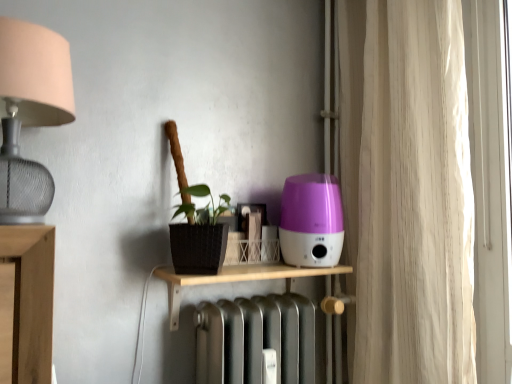
Question: Is beige fabric curtain at right inside purple glossy humidifier at center-right?

Choices:
 (A) no
 (B) yes

Answer: (A)

Question: Could you tell me if purple glossy humidifier at center-right is turned towards beige fabric curtain at right?

Choices:
 (A) no
 (B) yes

Answer: (A)

Question: Does purple glossy humidifier at center-right have a lesser height compared to beige fabric curtain at right?

Choices:
 (A) no
 (B) yes

Answer: (B)

Question: Is purple glossy humidifier at center-right further to camera compared to beige fabric curtain at right?

Choices:
 (A) no
 (B) yes

Answer: (B)

Question: From the image's perspective, is purple glossy humidifier at center-right below beige fabric curtain at right?

Choices:
 (A) yes
 (B) no

Answer: (A)

Question: From the image's perspective, relative to beige fabric curtain at right, is wooden shelf at center above or below?

Choices:
 (A) below
 (B) above

Answer: (A)

Question: From a real-world perspective, relative to beige fabric curtain at right, is wooden shelf at center vertically above or below?

Choices:
 (A) above
 (B) below

Answer: (B)

Question: Is point (335, 289) positioned closer to the camera than point (385, 135)?

Choices:
 (A) farther
 (B) closer

Answer: (A)

Question: Visually, is wooden shelf at center positioned to the left or to the right of beige fabric curtain at right?

Choices:
 (A) left
 (B) right

Answer: (A)

Question: Is matte silver lampshade at left situated inside purple glossy humidifier at center-right or outside?

Choices:
 (A) outside
 (B) inside

Answer: (A)

Question: Is point (0, 34) positioned closer to the camera than point (318, 177)?

Choices:
 (A) closer
 (B) farther

Answer: (A)

Question: From a real-world perspective, relative to purple glossy humidifier at center-right, is matte silver lampshade at left vertically above or below?

Choices:
 (A) below
 (B) above

Answer: (B)

Question: From the image's perspective, is matte silver lampshade at left above or below purple glossy humidifier at center-right?

Choices:
 (A) above
 (B) below

Answer: (A)

Question: Is wooden shelf at center inside the boundaries of matte silver lampshade at left, or outside?

Choices:
 (A) inside
 (B) outside

Answer: (B)

Question: In the image, is wooden shelf at center on the left side or the right side of matte silver lampshade at left?

Choices:
 (A) left
 (B) right

Answer: (B)